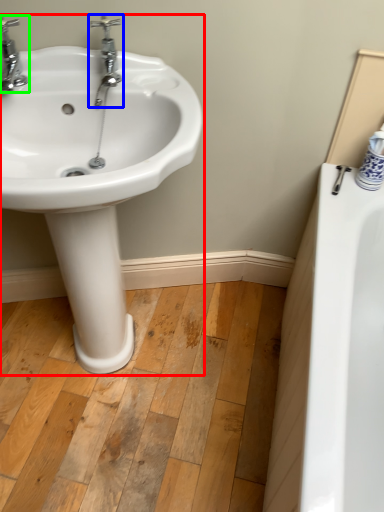
Question: Based on their relative distances, which object is nearer to sink (highlighted by a red box)? Choose from tap (highlighted by a blue box) and tap (highlighted by a green box).

Choices:
 (A) tap
 (B) tap

Answer: (A)